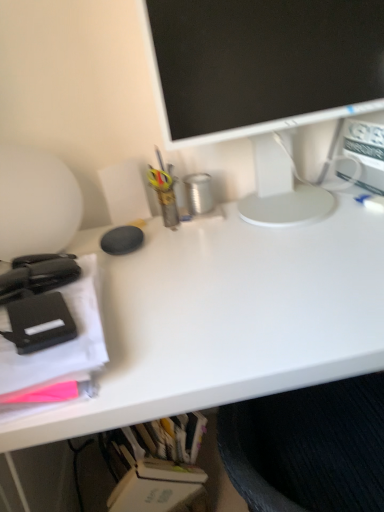
Question: Does matte black stapler at left, which appears as the 2th office supplies when viewed from the back, have a greater height compared to white glossy monitor at upper center?

Choices:
 (A) no
 (B) yes

Answer: (A)

Question: From the image's perspective, is matte black stapler at left, arranged as the first office supplies when viewed from the front, over white glossy monitor at upper center?

Choices:
 (A) yes
 (B) no

Answer: (B)

Question: Can you confirm if matte black stapler at left, arranged as the first office supplies when viewed from the front, is bigger than white glossy monitor at upper center?

Choices:
 (A) no
 (B) yes

Answer: (A)

Question: From a real-world perspective, is matte black stapler at left, which appears as the 2th office supplies when viewed from the back, physically below white glossy monitor at upper center?

Choices:
 (A) no
 (B) yes

Answer: (B)

Question: Considering the relative sizes of matte black stapler at left, which appears as the 2th office supplies when viewed from the back, and white glossy monitor at upper center in the image provided, is matte black stapler at left, which appears as the 2th office supplies when viewed from the back, thinner than white glossy monitor at upper center?

Choices:
 (A) yes
 (B) no

Answer: (B)

Question: Which is correct: black matte stapler at left, which ranks as the first office supplies in back-to-front order, is inside white matte desk at center, or outside of it?

Choices:
 (A) inside
 (B) outside

Answer: (B)

Question: From a real-world perspective, relative to white matte desk at center, is black matte stapler at left, which appears as the second office supplies when viewed from the front, vertically above or below?

Choices:
 (A) below
 (B) above

Answer: (B)

Question: From the image's perspective, is black matte stapler at left, which appears as the second office supplies when viewed from the front, above or below white matte desk at center?

Choices:
 (A) above
 (B) below

Answer: (A)

Question: Looking at the image, does black matte stapler at left, which appears as the second office supplies when viewed from the front, seem bigger or smaller compared to white matte desk at center?

Choices:
 (A) small
 (B) big

Answer: (A)

Question: Is white glossy monitor at upper center to the left or to the right of black matte stapler at left, which appears as the second office supplies when viewed from the front, in the image?

Choices:
 (A) right
 (B) left

Answer: (A)

Question: Is white glossy monitor at upper center wider or thinner than black matte stapler at left, which appears as the second office supplies when viewed from the front?

Choices:
 (A) thin
 (B) wide

Answer: (B)

Question: From the image's perspective, relative to black matte stapler at left, which ranks as the first office supplies in back-to-front order, is white glossy monitor at upper center above or below?

Choices:
 (A) below
 (B) above

Answer: (B)

Question: Considering their positions, is white glossy monitor at upper center located in front of or behind black matte stapler at left, which ranks as the first office supplies in back-to-front order?

Choices:
 (A) front
 (B) behind

Answer: (B)

Question: Considering the relative positions of matte black stapler at left, which appears as the 2th office supplies when viewed from the back, and black matte stapler at left, which appears as the second office supplies when viewed from the front, in the image provided, is matte black stapler at left, which appears as the 2th office supplies when viewed from the back, to the left or to the right of black matte stapler at left, which appears as the second office supplies when viewed from the front,?

Choices:
 (A) right
 (B) left

Answer: (A)

Question: Is point (89, 304) positioned closer to the camera than point (66, 265)?

Choices:
 (A) closer
 (B) farther

Answer: (A)